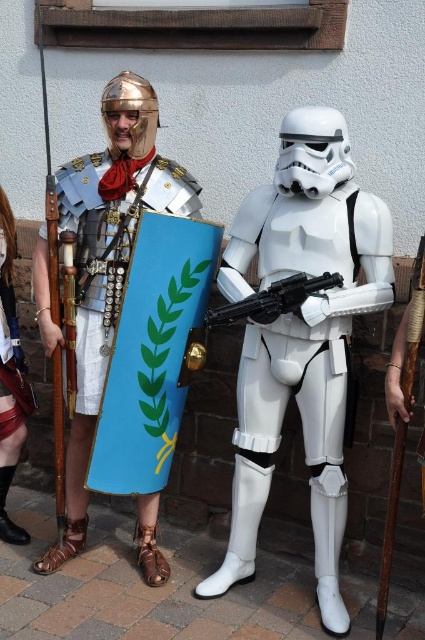
Between shiny red skirt at lower left and black plastic blaster at center, which one appears on the right side from the viewer's perspective?

black plastic blaster at center is more to the right.

Between point (8, 412) and point (274, 296), which one is positioned behind?

Point (8, 412)

Find the location of `shiny red skirt at lower left`. shiny red skirt at lower left is located at coordinates pos(11,355).

Can you confirm if white plastic stormtrooper at center is wider than metallic armor at left?

Indeed, white plastic stormtrooper at center has a greater width compared to metallic armor at left.

Who is more distant from viewer, (367, 250) or (113, 200)?

Positioned behind is point (113, 200).

At what (x,y) coordinates should I click in order to perform the action: click on white plastic stormtrooper at center. Please return your answer as a coordinate pair (x, y). The image size is (425, 640). Looking at the image, I should click on (302, 337).

Does metallic armor at left have a smaller size compared to black plastic blaster at center?

Actually, metallic armor at left might be larger than black plastic blaster at center.

Consider the image. Between metallic armor at left and black plastic blaster at center, which one appears on the right side from the viewer's perspective?

From the viewer's perspective, black plastic blaster at center appears more on the right side.

The image size is (425, 640). Identify the location of metallic armor at left. pyautogui.click(x=107, y=260).